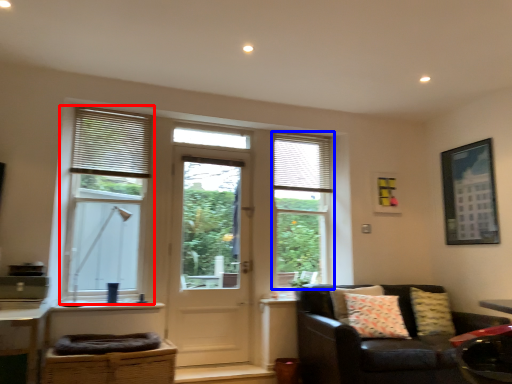
Question: Among these objects, which one is farthest to the camera, window (highlighted by a red box) or window (highlighted by a blue box)?

Choices:
 (A) window
 (B) window

Answer: (B)